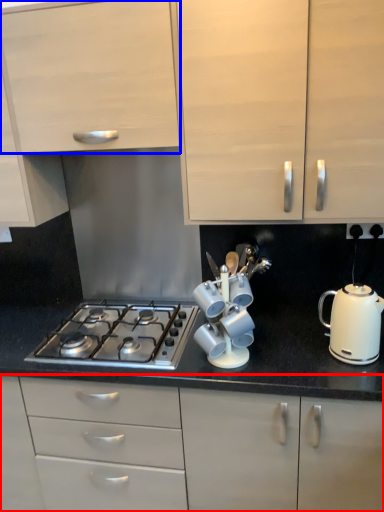
Question: Among these objects, which one is farthest to the camera, cabinetry (highlighted by a red box) or cabinetry (highlighted by a blue box)?

Choices:
 (A) cabinetry
 (B) cabinetry

Answer: (A)